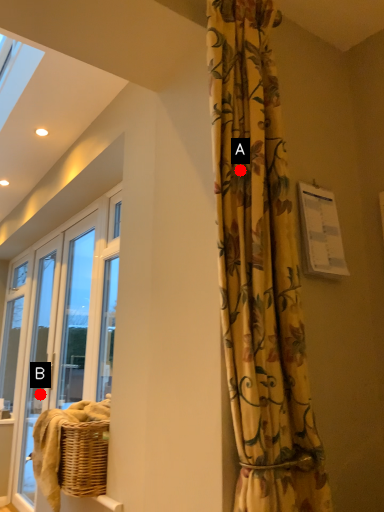
Question: Two points are circled on the image, labeled by A and B beside each circle. Among these points, which one is nearest to the camera?

Choices:
 (A) A is closer
 (B) B is closer

Answer: (A)